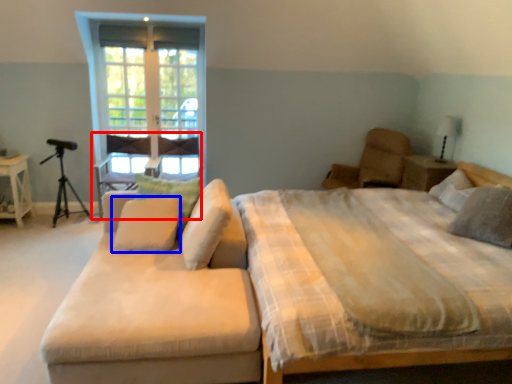
Question: Which of the following is the closest to the observer, armchair (highlighted by a red box) or pillow (highlighted by a blue box)?

Choices:
 (A) armchair
 (B) pillow

Answer: (B)